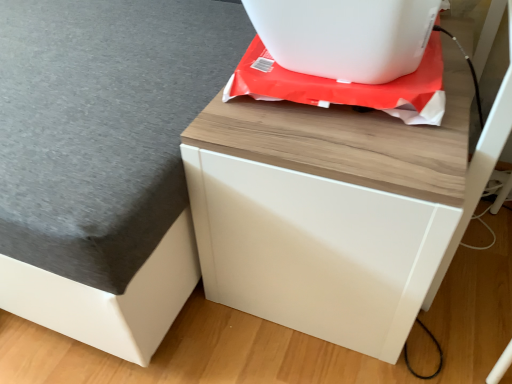
Question: Does white matte drawer at center have a smaller size compared to white plastic appliance at upper center?

Choices:
 (A) yes
 (B) no

Answer: (B)

Question: Are white matte drawer at center and white plastic appliance at upper center located far from each other?

Choices:
 (A) yes
 (B) no

Answer: (B)

Question: From a real-world perspective, does white matte drawer at center sit lower than white plastic appliance at upper center?

Choices:
 (A) yes
 (B) no

Answer: (A)

Question: From a real-world perspective, is white matte drawer at center positioned over white plastic appliance at upper center based on gravity?

Choices:
 (A) no
 (B) yes

Answer: (A)

Question: Is white matte drawer at center at the left side of white plastic appliance at upper center?

Choices:
 (A) no
 (B) yes

Answer: (A)

Question: From the image's perspective, is white plastic appliance at upper center above or below white matte drawer at center?

Choices:
 (A) below
 (B) above

Answer: (B)

Question: Would you say white plastic appliance at upper center is inside or outside white matte drawer at center?

Choices:
 (A) outside
 (B) inside

Answer: (A)

Question: Considering the positions of white plastic appliance at upper center and white matte drawer at center in the image, is white plastic appliance at upper center taller or shorter than white matte drawer at center?

Choices:
 (A) tall
 (B) short

Answer: (B)

Question: Considering the positions of point (428, 1) and point (252, 276), is point (428, 1) closer or farther from the camera than point (252, 276)?

Choices:
 (A) closer
 (B) farther

Answer: (A)

Question: Is white matte drawer at center inside the boundaries of wooden table at upper right, or outside?

Choices:
 (A) outside
 (B) inside

Answer: (A)

Question: Is point (440, 274) closer or farther from the camera than point (199, 274)?

Choices:
 (A) farther
 (B) closer

Answer: (B)

Question: In the image, is white matte drawer at center on the left side or the right side of wooden table at upper right?

Choices:
 (A) left
 (B) right

Answer: (B)

Question: From the image's perspective, is white matte drawer at center located above or below wooden table at upper right?

Choices:
 (A) below
 (B) above

Answer: (A)

Question: In terms of size, does white matte drawer at center appear bigger or smaller than white plastic appliance at upper center?

Choices:
 (A) big
 (B) small

Answer: (A)

Question: From the image's perspective, is white matte drawer at center above or below white plastic appliance at upper center?

Choices:
 (A) above
 (B) below

Answer: (B)